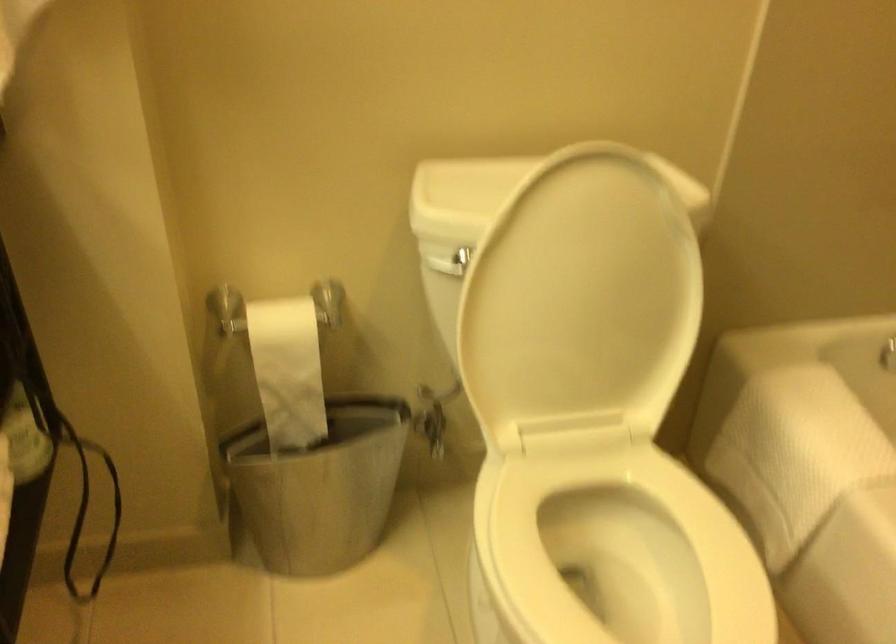
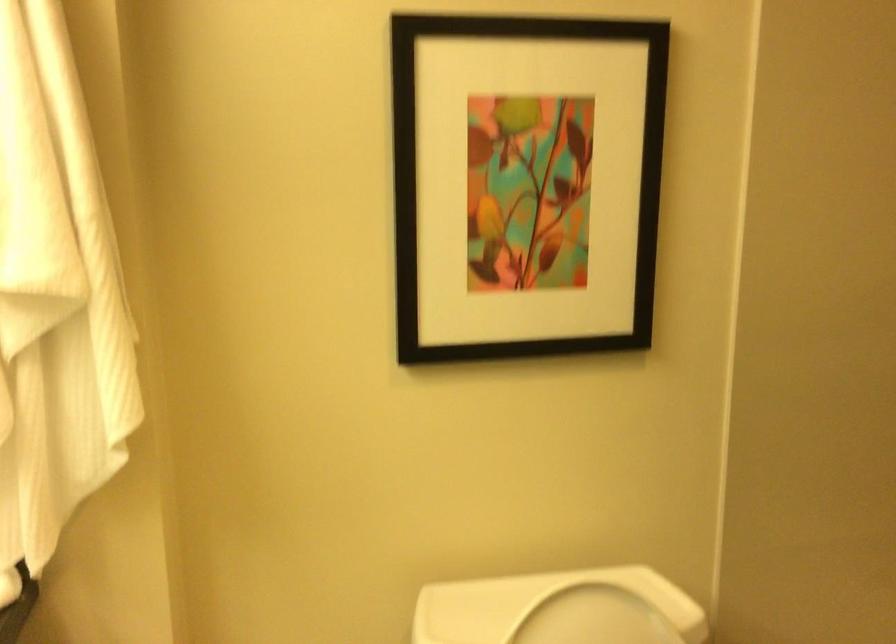
Question: What movement of the cameraman would produce the second image?

Choices:
 (A) Left
 (B) Right
 (C) Forward
 (D) Backward

Answer: (D)